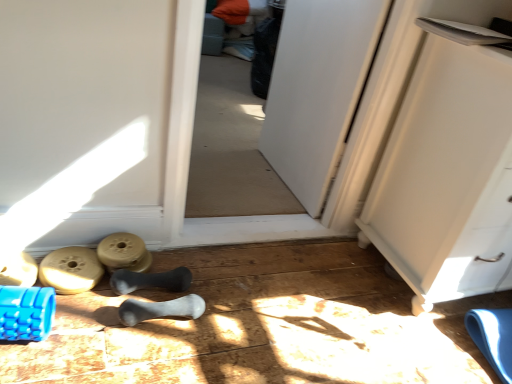
Question: Considering the relative positions of gray rubber bone at center, which is the 3th footwear in left-to-right order, and white matte cabinet at right in the image provided, is gray rubber bone at center, which is the 3th footwear in left-to-right order, to the left of white matte cabinet at right from the viewer's perspective?

Choices:
 (A) yes
 (B) no

Answer: (A)

Question: Considering the relative sizes of gray rubber bone at center, which is the 3th footwear in left-to-right order, and white matte cabinet at right in the image provided, is gray rubber bone at center, which is the 3th footwear in left-to-right order, shorter than white matte cabinet at right?

Choices:
 (A) yes
 (B) no

Answer: (A)

Question: Can you confirm if gray rubber bone at center, which is the 3th footwear in left-to-right order, is smaller than white matte cabinet at right?

Choices:
 (A) no
 (B) yes

Answer: (B)

Question: Is gray rubber bone at center, positioned as the 2th footwear in right-to-left order, facing towards white matte cabinet at right?

Choices:
 (A) yes
 (B) no

Answer: (B)

Question: Does gray rubber bone at center, which is the 3th footwear in left-to-right order, have a lesser width compared to white matte cabinet at right?

Choices:
 (A) yes
 (B) no

Answer: (A)

Question: Is matte plastic weight at lower center, acting as the first job starting from the right, taller or shorter than matte rubber dumbbell at lower left, which appears as the third footwear when viewed from the right?

Choices:
 (A) tall
 (B) short

Answer: (A)

Question: Is matte plastic weight at lower center, acting as the first job starting from the right, wider or thinner than matte rubber dumbbell at lower left, which appears as the third footwear when viewed from the right?

Choices:
 (A) wide
 (B) thin

Answer: (B)

Question: From the image's perspective, is matte plastic weight at lower center, placed as the 1th job when sorted from back to front, located above or below matte rubber dumbbell at lower left, which appears as the third footwear when viewed from the right?

Choices:
 (A) above
 (B) below

Answer: (A)

Question: Looking at the image, does matte plastic weight at lower center, placed as the 1th job when sorted from back to front, seem bigger or smaller compared to matte rubber dumbbell at lower left, the 2th footwear when ordered from left to right?

Choices:
 (A) small
 (B) big

Answer: (A)

Question: Is point (94, 266) closer or farther from the camera than point (159, 306)?

Choices:
 (A) farther
 (B) closer

Answer: (A)

Question: Visually, is matte rubber dumbbell at lower left, the 2th footwear when ordered from left to right, positioned to the left or to the right of gray rubber bone at center, arranged as the 4th footwear when viewed from the left?

Choices:
 (A) right
 (B) left

Answer: (B)

Question: Looking at their shapes, would you say matte rubber dumbbell at lower left, the 2th footwear when ordered from left to right, is wider or thinner than gray rubber bone at center, arranged as the first footwear when viewed from the right?

Choices:
 (A) wide
 (B) thin

Answer: (A)

Question: From a real-world perspective, is matte rubber dumbbell at lower left, which appears as the third footwear when viewed from the right, physically located above or below gray rubber bone at center, arranged as the first footwear when viewed from the right?

Choices:
 (A) below
 (B) above

Answer: (A)

Question: Is point (105, 256) closer or farther from the camera than point (4, 294)?

Choices:
 (A) farther
 (B) closer

Answer: (A)

Question: Do you think matte plastic weight at lower center, placed as the 1th job when sorted from back to front, is within blue textured foam roller at lower left, acting as the second job starting from the back, or outside of it?

Choices:
 (A) inside
 (B) outside

Answer: (B)